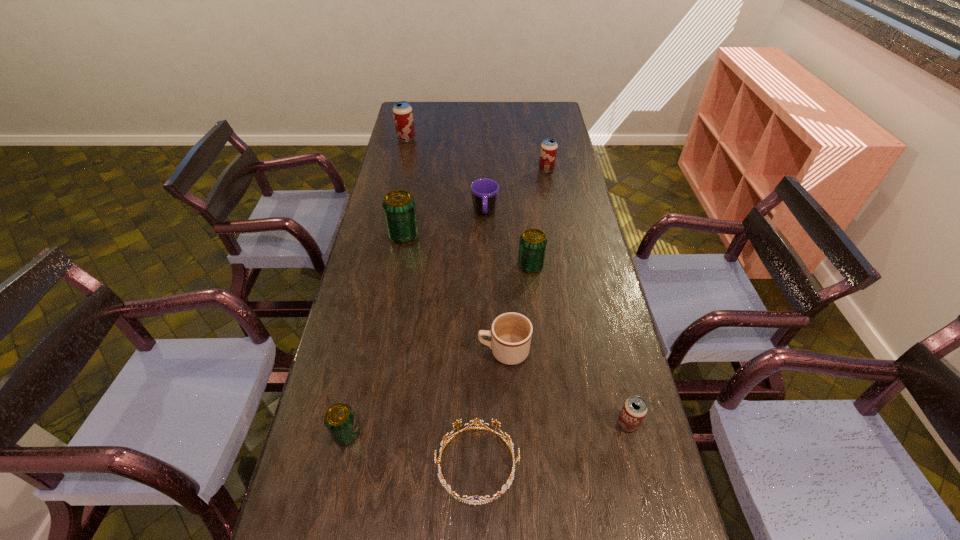
Image resolution: width=960 pixels, height=540 pixels. Identify the location of the third farthest beer can. (399, 207).

Find the location of a particular element. This screenshot has width=960, height=540. the biggest green beer can is located at coordinates (399, 207).

Find the location of `the farthest red beer can`. the farthest red beer can is located at coordinates (403, 116).

The image size is (960, 540). I want to click on the farthest beer can, so click(x=403, y=116).

Find the location of a particular element. The height and width of the screenshot is (540, 960). the eighth nearest object is located at coordinates (548, 153).

At what (x,y) coordinates should I click in order to perform the action: click on the second farthest red beer can. Please return your answer as a coordinate pair (x, y). Looking at the image, I should click on (548, 153).

Identify the location of the second smallest green beer can. This screenshot has width=960, height=540. (533, 242).

I want to click on the rightmost green beer can, so click(x=533, y=242).

Where is `brown mug`? brown mug is located at coordinates (511, 333).

Where is `the fourth nearest object`? The image size is (960, 540). the fourth nearest object is located at coordinates tap(511, 333).